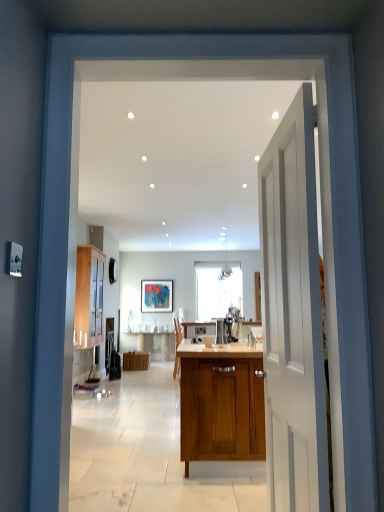
Question: Choose the correct answer: Is wooden cabinet at left, placed as the 1th cabinetry when sorted from front to back, inside wooden cabinet at center, positioned as the 1th cabinetry in back-to-front order, or outside it?

Choices:
 (A) inside
 (B) outside

Answer: (B)

Question: Is wooden cabinet at left, the second cabinetry when ordered from bottom to top, taller or shorter than wooden cabinet at center, which appears as the 1th cabinetry when viewed from the right?

Choices:
 (A) short
 (B) tall

Answer: (B)

Question: Which object is the farthest from the wooden cabinet at center, which appears as the second cabinetry when viewed from the left?

Choices:
 (A) wooden cabinet at left, the second cabinetry when ordered from right to left
 (B) satin silver coffee machine at center
 (C) white smooth door at right

Answer: (C)

Question: Estimate the real-world distances between objects in this image. Which object is farther from the satin silver coffee machine at center?

Choices:
 (A) wooden cabinet at center, the first cabinetry when ordered from bottom to top
 (B) wooden cabinet at left, the second cabinetry from the back
 (C) white smooth door at right

Answer: (A)